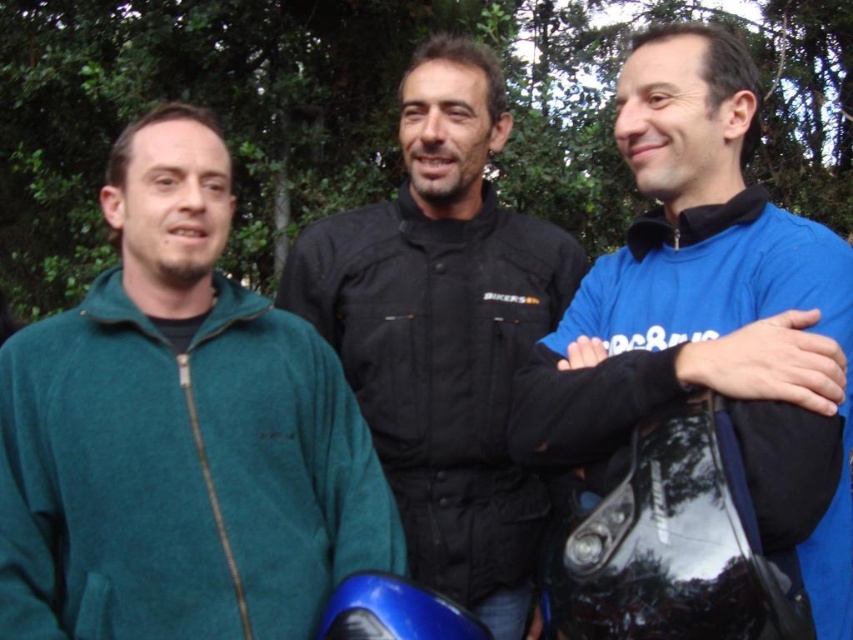
Who is more forward, (567,260) or (664,154)?

Positioned in front is point (664,154).

Image resolution: width=853 pixels, height=640 pixels. Describe the element at coordinates (444, 332) in the screenshot. I see `black matte jacket at center` at that location.

Find the location of `black matte jacket at center`. black matte jacket at center is located at coordinates (444, 332).

Is teal fleece jacket at left positioned behind black matte jacket at center?

No.

Does teal fleece jacket at left have a lesser height compared to black matte jacket at center?

Yes, teal fleece jacket at left is shorter than black matte jacket at center.

Is point (6, 381) closer to viewer compared to point (505, 528)?

Yes, it is.

Locate an element on the screen. This screenshot has width=853, height=640. teal fleece jacket at left is located at coordinates (178, 433).

Measure the distance from teal fleece jacket at left to blue fleece jacket at center.

The distance of teal fleece jacket at left from blue fleece jacket at center is 1.21 meters.

Consider the image. Does teal fleece jacket at left appear over blue fleece jacket at center?

Actually, teal fleece jacket at left is below blue fleece jacket at center.

Between point (242, 577) and point (769, 301), which one is positioned in front?

Positioned in front is point (769, 301).

The image size is (853, 640). What are the coordinates of `teal fleece jacket at left` in the screenshot? It's located at (178, 433).